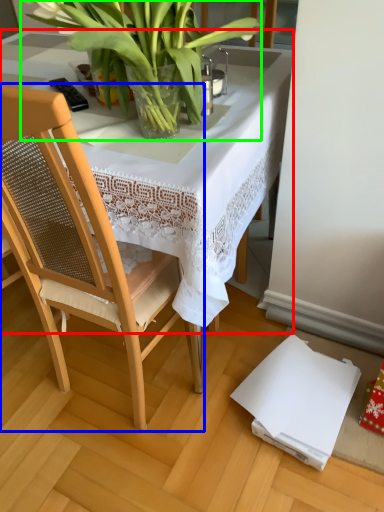
Question: Based on their relative distances, which object is nearer to table (highlighted by a red box)? Choose from chair (highlighted by a blue box) and houseplant (highlighted by a green box).

Choices:
 (A) chair
 (B) houseplant

Answer: (B)